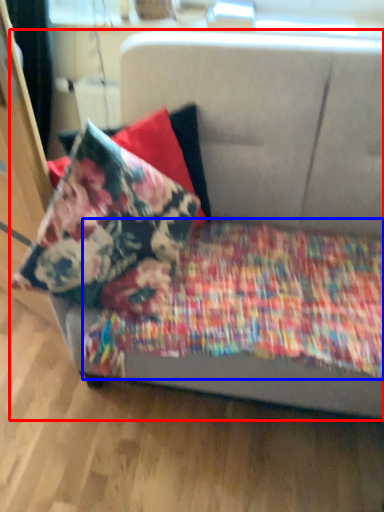
Question: Which point is further to the camera, studio couch (highlighted by a red box) or blanket (highlighted by a blue box)?

Choices:
 (A) studio couch
 (B) blanket

Answer: (B)